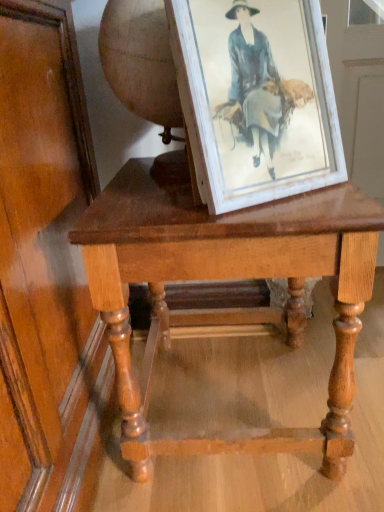
Question: Is light brown wooden table at center bigger or smaller than white distressed wood picture frame at center?

Choices:
 (A) small
 (B) big

Answer: (B)

Question: Does point (137, 418) appear closer or farther from the camera than point (279, 159)?

Choices:
 (A) farther
 (B) closer

Answer: (A)

Question: Would you say light brown wooden table at center is inside or outside white distressed wood picture frame at center?

Choices:
 (A) inside
 (B) outside

Answer: (B)

Question: Looking at their shapes, would you say white distressed wood picture frame at center is wider or thinner than light brown wooden table at center?

Choices:
 (A) wide
 (B) thin

Answer: (B)

Question: From the image's perspective, relative to light brown wooden table at center, is white distressed wood picture frame at center above or below?

Choices:
 (A) below
 (B) above

Answer: (B)

Question: Choose the correct answer: Is white distressed wood picture frame at center inside light brown wooden table at center or outside it?

Choices:
 (A) outside
 (B) inside

Answer: (A)

Question: Considering their positions, is white distressed wood picture frame at center located in front of or behind light brown wooden table at center?

Choices:
 (A) behind
 (B) front

Answer: (B)